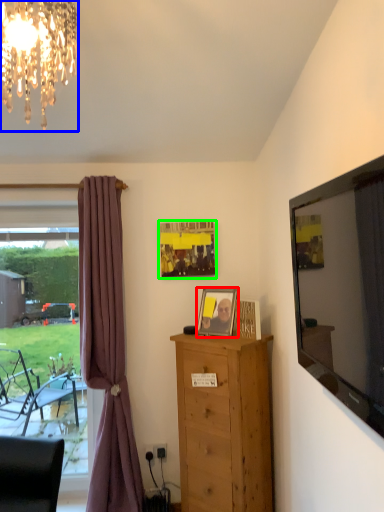
Question: Which object is positioned farthest from picture frame (highlighted by a red box)? Select from lamp (highlighted by a blue box) and picture frame (highlighted by a green box).

Choices:
 (A) lamp
 (B) picture frame

Answer: (A)